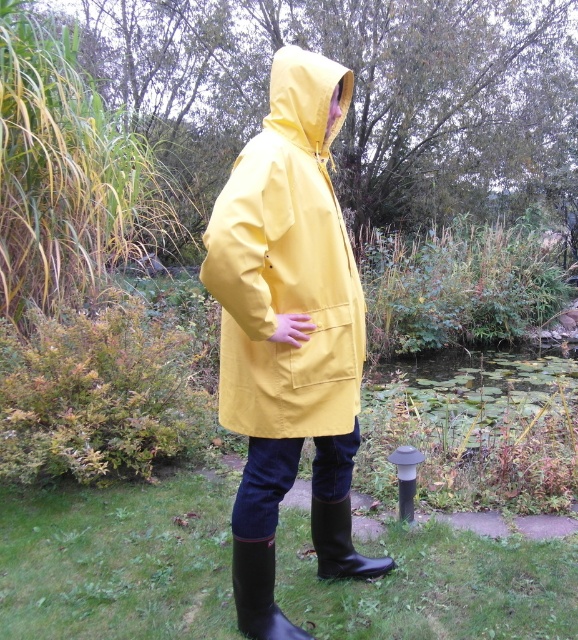
Between point (253, 304) and point (334, 518), which one is positioned in front?

Positioned in front is point (253, 304).

This screenshot has width=578, height=640. In order to click on yellow matte raincoat at center in this screenshot , I will do `click(287, 266)`.

Can you confirm if yellow matte hood at upper center is positioned above rubber/matte boot at lower center?

Indeed, yellow matte hood at upper center is positioned over rubber/matte boot at lower center.

Who is more distant from viewer, (x=331, y=132) or (x=284, y=625)?

The point (x=331, y=132) is behind.

Where is `yellow matte hood at upper center`? This screenshot has height=640, width=578. yellow matte hood at upper center is located at coordinates (306, 99).

Is rubber/matte boot at lower center below black rubber boot at lower center?

Yes, rubber/matte boot at lower center is below black rubber boot at lower center.

Who is lower down, rubber/matte boot at lower center or black rubber boot at lower center?

rubber/matte boot at lower center

Where is `rubber/matte boot at lower center`? This screenshot has width=578, height=640. rubber/matte boot at lower center is located at coordinates (258, 593).

At what (x,y) coordinates should I click in order to perform the action: click on rubber/matte boot at lower center. Please return your answer as a coordinate pair (x, y). This screenshot has width=578, height=640. Looking at the image, I should click on (258, 593).